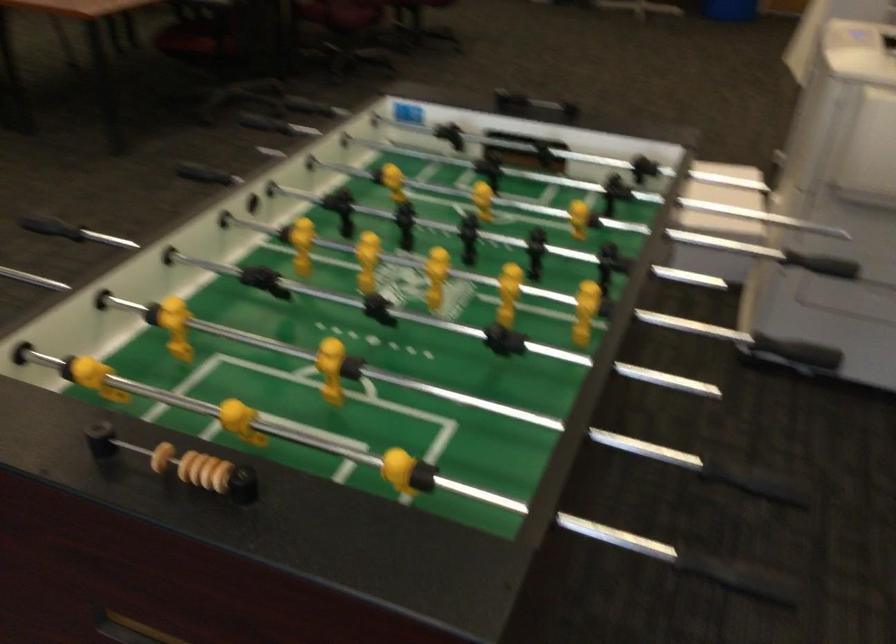
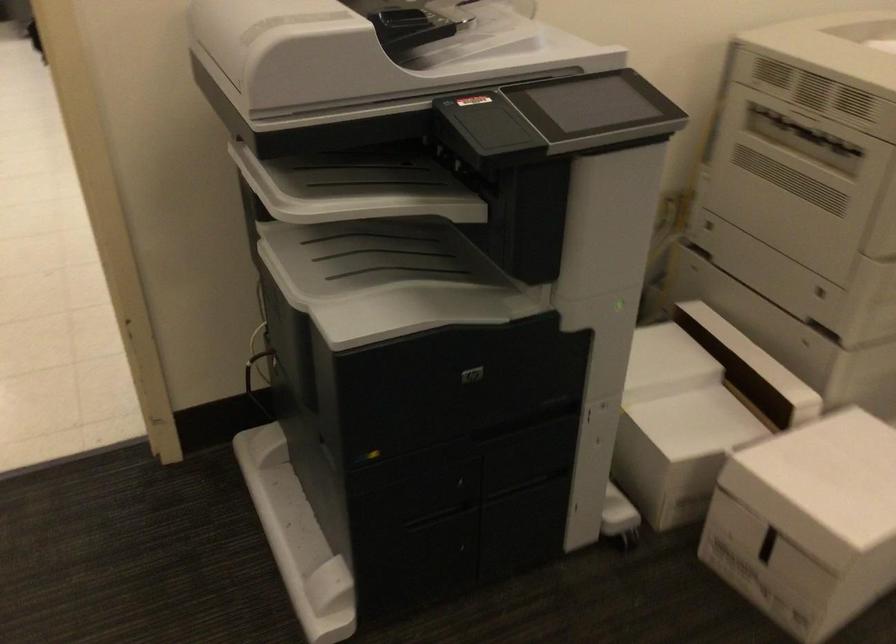
The point at (686,167) is marked in the first image. Where is the corresponding point in the second image?

(807, 522)